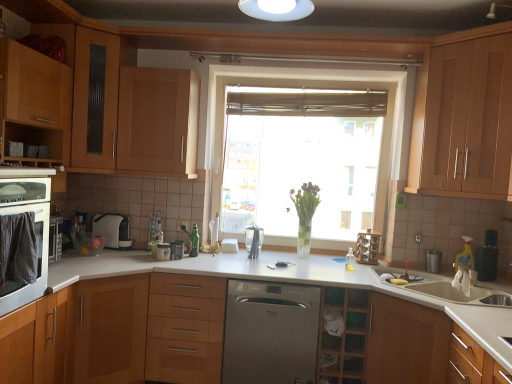
Question: Could satin metallic dishwasher at center be considered to be inside metallic silver toaster at center, the 2th appliance in the left-to-right sequence?

Choices:
 (A) yes
 (B) no

Answer: (B)

Question: Does metallic silver toaster at center, acting as the 3th appliance starting from the right, have a greater height compared to satin metallic dishwasher at center?

Choices:
 (A) yes
 (B) no

Answer: (B)

Question: Is metallic silver toaster at center, acting as the 3th appliance starting from the right, closer to the viewer compared to satin metallic dishwasher at center?

Choices:
 (A) yes
 (B) no

Answer: (B)

Question: From a real-world perspective, is metallic silver toaster at center, acting as the 3th appliance starting from the right, physically below satin metallic dishwasher at center?

Choices:
 (A) yes
 (B) no

Answer: (B)

Question: Is metallic silver toaster at center, acting as the 3th appliance starting from the right, aimed at satin metallic dishwasher at center?

Choices:
 (A) no
 (B) yes

Answer: (A)

Question: Is metallic silver toaster at center, the 2th appliance in the left-to-right sequence, completely or partially outside of satin metallic dishwasher at center?

Choices:
 (A) no
 (B) yes

Answer: (B)

Question: Is wooden drawer at center looking in the opposite direction of satin silver coffee machine at lower left, which is the 1th appliance from left to right?

Choices:
 (A) yes
 (B) no

Answer: (B)

Question: Considering the relative sizes of wooden drawer at center and satin silver coffee machine at lower left, which is the 1th appliance from left to right, in the image provided, is wooden drawer at center taller than satin silver coffee machine at lower left, which is the 1th appliance from left to right,?

Choices:
 (A) no
 (B) yes

Answer: (B)

Question: Does wooden drawer at center appear on the left side of satin silver coffee machine at lower left, placed as the fourth appliance when sorted from right to left?

Choices:
 (A) no
 (B) yes

Answer: (A)

Question: Is wooden drawer at center completely or partially outside of satin silver coffee machine at lower left, which is the 1th appliance from left to right?

Choices:
 (A) yes
 (B) no

Answer: (A)

Question: Does wooden drawer at center turn towards satin silver coffee machine at lower left, which is the 1th appliance from left to right?

Choices:
 (A) no
 (B) yes

Answer: (A)

Question: Considering the relative sizes of wooden drawer at center and satin silver coffee machine at lower left, placed as the fourth appliance when sorted from right to left, in the image provided, is wooden drawer at center wider than satin silver coffee machine at lower left, placed as the fourth appliance when sorted from right to left,?

Choices:
 (A) no
 (B) yes

Answer: (B)

Question: Can you confirm if translucent glass window at center is positioned to the left of matte wood cabinet at left, placed as the second cabinetry when sorted from left to right?

Choices:
 (A) yes
 (B) no

Answer: (B)